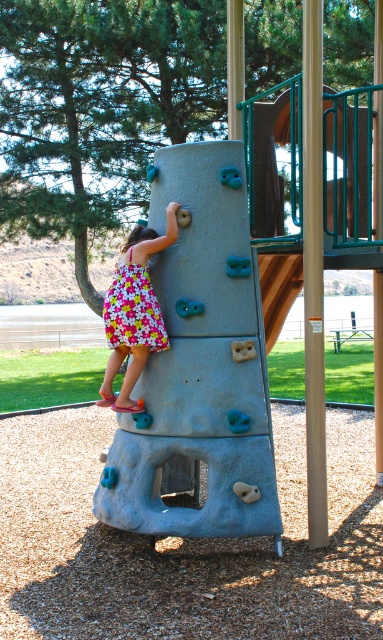
Does floral cotton dress at center have a lesser height compared to wooden at center?

Indeed, floral cotton dress at center has a lesser height compared to wooden at center.

From the picture: Who is more distant from viewer, (150, 296) or (296, 259)?

The point (296, 259) is more distant.

You are a GUI agent. You are given a task and a screenshot of the screen. Output one action in this format:
    pyautogui.click(x=<x>, y=<y>)
    Task: Click on the floral cotton dress at center
    
    Given the screenshot: What is the action you would take?
    [x=132, y=308]

In the scene shown: Does floral fabric dress at center have a lesser height compared to wooden at center?

No, floral fabric dress at center is not shorter than wooden at center.

Can you confirm if floral fabric dress at center is smaller than wooden at center?

Actually, floral fabric dress at center might be larger than wooden at center.

The width and height of the screenshot is (383, 640). What do you see at coordinates (134, 312) in the screenshot?
I see `floral fabric dress at center` at bounding box center [134, 312].

You are a GUI agent. You are given a task and a screenshot of the screen. Output one action in this format:
    pyautogui.click(x=<x>, y=<y>)
    Task: Click on the floral fabric dress at center
    
    Given the screenshot: What is the action you would take?
    pyautogui.click(x=134, y=312)

Between floral fabric dress at center and floral cotton dress at center, which one has less height?

With less height is floral cotton dress at center.

Is point (132, 364) less distant than point (127, 273)?

No.

You are a GUI agent. You are given a task and a screenshot of the screen. Output one action in this format:
    pyautogui.click(x=<x>, y=<y>)
    Task: Click on the floral fabric dress at center
    Image resolution: width=383 pixels, height=640 pixels.
    Given the screenshot: What is the action you would take?
    pyautogui.click(x=134, y=312)